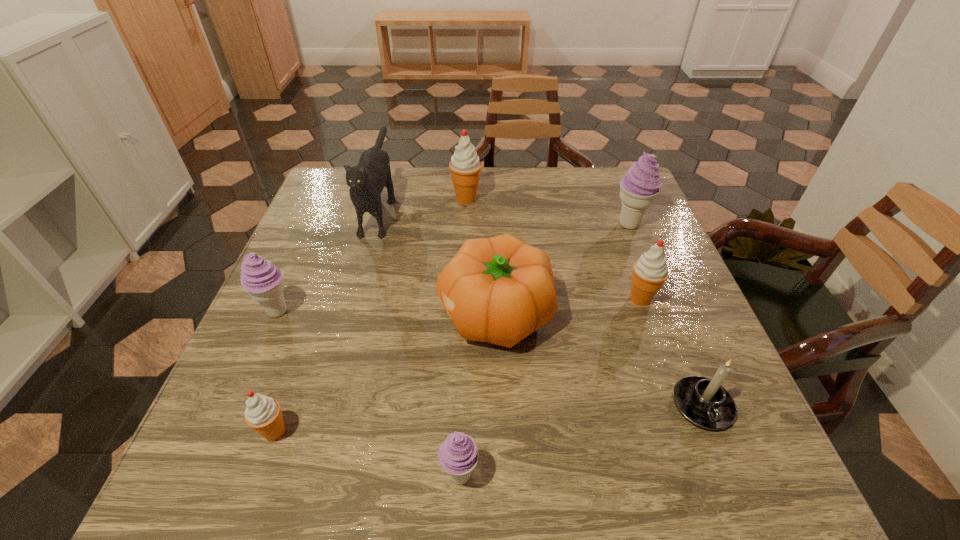
I want to click on black cat, so click(366, 180).

Image resolution: width=960 pixels, height=540 pixels. Identify the location of the third object from left to right. (366, 180).

This screenshot has height=540, width=960. I want to click on the farthest red icecream, so click(x=465, y=167).

At what (x,y) coordinates should I click in order to perform the action: click on the second red icecream from left to right. Please return your answer as a coordinate pair (x, y). The height and width of the screenshot is (540, 960). Looking at the image, I should click on (465, 167).

Locate an element on the screen. The image size is (960, 540). the biggest purple icecream is located at coordinates (641, 184).

Locate an element on the screen. Image resolution: width=960 pixels, height=540 pixels. the fifth nearest icecream is located at coordinates (641, 184).

Locate an element on the screen. pumpkin is located at coordinates (499, 290).

Image resolution: width=960 pixels, height=540 pixels. Find the location of `the rightmost red icecream`. the rightmost red icecream is located at coordinates (649, 272).

Image resolution: width=960 pixels, height=540 pixels. In order to click on the second farthest red icecream in this screenshot , I will do `click(649, 272)`.

Locate an element on the screen. The height and width of the screenshot is (540, 960). the leftmost icecream is located at coordinates (260, 278).